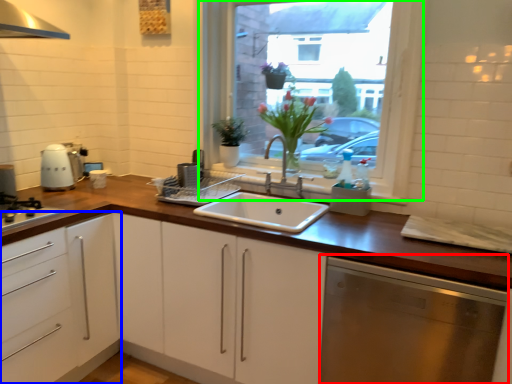
Question: Which is nearer to the dish washer (highlighted by a red box)? cabinetry (highlighted by a blue box) or window (highlighted by a green box).

Choices:
 (A) cabinetry
 (B) window

Answer: (A)